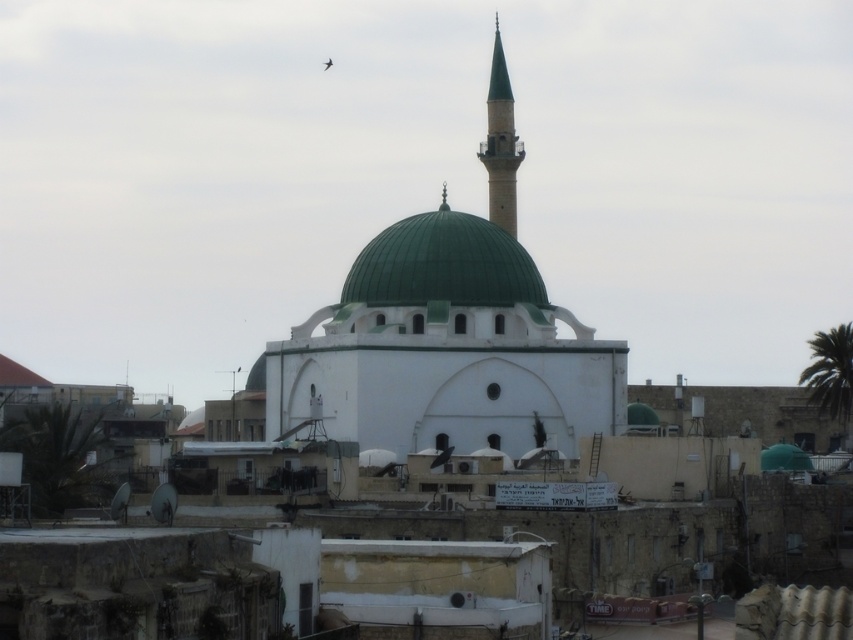
Question: In this image, where is green matte dome at center located relative to green glazed minaret at upper center?

Choices:
 (A) above
 (B) below

Answer: (B)

Question: Does green matte dome at center have a lesser width compared to green glazed minaret at upper center?

Choices:
 (A) no
 (B) yes

Answer: (A)

Question: Is green matte dome at center positioned in front of green glazed minaret at upper center?

Choices:
 (A) no
 (B) yes

Answer: (B)

Question: Among these points, which one is farthest from the camera?

Choices:
 (A) (498, 42)
 (B) (380, 260)

Answer: (A)